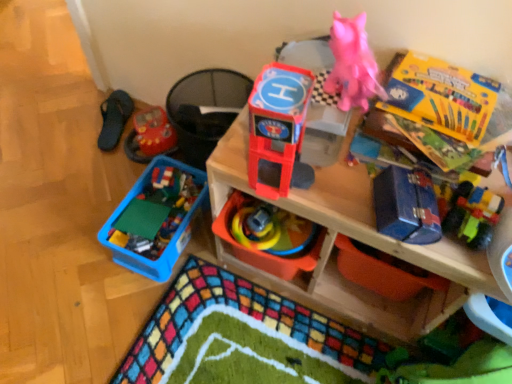
Measure the distance between point (389, 184) and camera.

Point (389, 184) and camera are 33.31 inches apart.

Describe the element at coordinates (114, 119) in the screenshot. I see `black fabric slipper at left` at that location.

What do you see at coordinates (150, 136) in the screenshot?
I see `rubberized red toy car at left, acting as the fifth toy starting from the front` at bounding box center [150, 136].

I want to click on rubberized red toy car at left, acting as the fifth toy starting from the front, so click(150, 136).

What do you see at coordinates (172, 237) in the screenshot?
I see `blue plastic container at lower left, the 4th toy viewed from the front` at bounding box center [172, 237].

Where is `blue metallic toolbox at upper right, placed as the first storage box when sorted from bottom to top`? blue metallic toolbox at upper right, placed as the first storage box when sorted from bottom to top is located at coordinates (380, 294).

Considering the relative sizes of yellow cardboard box at upper right, which appears as the third storage box when ordered from the bottom, and rubberized plastic toy at center, which is the 3th toy in back-to-front order, in the image provided, is yellow cardboard box at upper right, which appears as the third storage box when ordered from the bottom, wider than rubberized plastic toy at center, which is the 3th toy in back-to-front order,?

Yes.

From a real-world perspective, is yellow cardboard box at upper right, which appears as the third storage box when ordered from the bottom, on top of rubberized plastic toy at center, placed as the 3th toy when sorted from front to back?

Yes, from a real-world perspective, yellow cardboard box at upper right, which appears as the third storage box when ordered from the bottom, is above rubberized plastic toy at center, placed as the 3th toy when sorted from front to back.

Is yellow cardboard box at upper right, arranged as the first storage box when viewed from the top, oriented towards rubberized plastic toy at center, placed as the 3th toy when sorted from front to back?

No, yellow cardboard box at upper right, arranged as the first storage box when viewed from the top, is not facing towards rubberized plastic toy at center, placed as the 3th toy when sorted from front to back.

Does yellow cardboard box at upper right, which appears as the third storage box when ordered from the bottom, have a lesser height compared to rubberized plastic toy at center, which is the 3th toy in back-to-front order?

Yes.

From a real-world perspective, who is located lower, rubberized red toy car at left, the 1th toy positioned from the back, or matte plastic shelf at upper center?

rubberized red toy car at left, the 1th toy positioned from the back.

Considering the relative positions of rubberized red toy car at left, the 1th toy positioned from the back, and matte plastic shelf at upper center in the image provided, is rubberized red toy car at left, the 1th toy positioned from the back, to the left or to the right of matte plastic shelf at upper center?

In the image, rubberized red toy car at left, the 1th toy positioned from the back, appears on the left side of matte plastic shelf at upper center.

Between rubberized red toy car at left, the 1th toy positioned from the back, and matte plastic shelf at upper center, which one has less height?

rubberized red toy car at left, the 1th toy positioned from the back, is shorter.

Is matte plastic toy at upper center, which is the second storage box in bottom-to-top order, aimed at blue plastic container at lower left, the 4th toy viewed from the front?

No.

Is point (342, 122) behind point (150, 278)?

No.

From a real-world perspective, is matte plastic toy at upper center, which is the second storage box in bottom-to-top order, over blue plastic container at lower left, the second toy positioned from the back?

Yes, from a real-world perspective, matte plastic toy at upper center, which is the second storage box in bottom-to-top order, is over blue plastic container at lower left, the second toy positioned from the back

Can you confirm if matte plastic toy at upper center, which is the second storage box in bottom-to-top order, is shorter than blue plastic container at lower left, the 4th toy viewed from the front?

Yes.

From the image's perspective, which one is positioned lower, shiny plastic toy helicopter at center, which ranks as the first toy in front-to-back order, or rubberized plastic toy at center, placed as the 3th toy when sorted from front to back?

rubberized plastic toy at center, placed as the 3th toy when sorted from front to back, appears lower in the image.

Between shiny plastic toy helicopter at center, which ranks as the first toy in front-to-back order, and rubberized plastic toy at center, placed as the 3th toy when sorted from front to back, which one has smaller width?

With smaller width is shiny plastic toy helicopter at center, which ranks as the first toy in front-to-back order.

Is shiny plastic toy helicopter at center, which ranks as the first toy in front-to-back order, not close to rubberized plastic toy at center, placed as the 3th toy when sorted from front to back?

No.

How distant is shiny plastic toy helicopter at center, the 5th toy in the back-to-front sequence, from rubberized plastic toy at center, placed as the 3th toy when sorted from front to back?

A distance of 11.49 inches exists between shiny plastic toy helicopter at center, the 5th toy in the back-to-front sequence, and rubberized plastic toy at center, placed as the 3th toy when sorted from front to back.

Is matte plastic shelf at upper center looking in the opposite direction of matte plastic toy at upper center, which appears as the second storage box when viewed from the top?

matte plastic shelf at upper center is not turned away from matte plastic toy at upper center, which appears as the second storage box when viewed from the top.

Considering the sizes of matte plastic shelf at upper center and matte plastic toy at upper center, which appears as the second storage box when viewed from the top, in the image, is matte plastic shelf at upper center taller or shorter than matte plastic toy at upper center, which appears as the second storage box when viewed from the top,?

In the image, matte plastic shelf at upper center appears to be taller than matte plastic toy at upper center, which appears as the second storage box when viewed from the top.

Between matte plastic shelf at upper center and matte plastic toy at upper center, which appears as the second storage box when viewed from the top, which one has smaller width?

matte plastic toy at upper center, which appears as the second storage box when viewed from the top.

Is matte plastic shelf at upper center completely or partially outside of matte plastic toy at upper center, which is the second storage box in bottom-to-top order?

Yes, matte plastic shelf at upper center is not within matte plastic toy at upper center, which is the second storage box in bottom-to-top order.

Does black fabric slipper at left have a larger size compared to blue metallic toolbox at right, marked as the second toy in a front-to-back arrangement?

Yes.

Which is closer to the camera, [110,101] or [402,206]?

Point [110,101] appears to be farther away from the viewer than point [402,206].

Which object is further away from the camera taking this photo, black fabric slipper at left or blue metallic toolbox at right, placed as the 4th toy when sorted from back to front?

black fabric slipper at left is more distant.

How much distance is there between black fabric slipper at left and blue metallic toolbox at right, marked as the second toy in a front-to-back arrangement?

black fabric slipper at left is 3.84 feet away from blue metallic toolbox at right, marked as the second toy in a front-to-back arrangement.

Considering their positions, is matte plastic shelf at upper center located in front of or behind rubberized plastic toy at center, placed as the 3th toy when sorted from front to back?

Visually, matte plastic shelf at upper center is located in front of rubberized plastic toy at center, placed as the 3th toy when sorted from front to back.

Is matte plastic shelf at upper center aimed at rubberized plastic toy at center, placed as the 3th toy when sorted from front to back?

Yes, matte plastic shelf at upper center is turned towards rubberized plastic toy at center, placed as the 3th toy when sorted from front to back.

Between matte plastic shelf at upper center and rubberized plastic toy at center, placed as the 3th toy when sorted from front to back, which one has smaller size?

rubberized plastic toy at center, placed as the 3th toy when sorted from front to back.

From the image's perspective, which one is positioned lower, matte plastic shelf at upper center or rubberized plastic toy at center, placed as the 3th toy when sorted from front to back?

From the image's view, rubberized plastic toy at center, placed as the 3th toy when sorted from front to back, is below.

From the image's perspective, count 4th toys downward from the yellow cardboard box at upper right, arranged as the first storage box when viewed from the top, and point to it. Please provide its 2D coordinates.

[(269, 237)]

The width and height of the screenshot is (512, 384). I want to click on the 2nd toy located beneath the matte plastic shelf at upper center (from a real-world perspective), so click(x=150, y=136).

When comparing their distances from blue metallic toolbox at upper right, positioned as the 3th storage box in top-to-bottom order, does matte plastic toy at upper center, which appears as the second storage box when viewed from the top, or black fabric slipper at left seem closer?

matte plastic toy at upper center, which appears as the second storage box when viewed from the top, lies closer to blue metallic toolbox at upper right, positioned as the 3th storage box in top-to-bottom order, than the other object.

Estimate the real-world distances between objects in this image. Which object is further from matte plastic toy at upper center, which appears as the second storage box when viewed from the top, rubberized red toy car at left, the 1th toy positioned from the back, or black fabric slipper at left?

black fabric slipper at left.

Considering their positions, is blue metallic toolbox at right, marked as the second toy in a front-to-back arrangement, positioned further to matte plastic toy at upper center, which appears as the second storage box when viewed from the top, than black fabric slipper at left?

black fabric slipper at left is further to matte plastic toy at upper center, which appears as the second storage box when viewed from the top.

Which object lies nearer to the anchor point blue metallic toolbox at upper right, placed as the first storage box when sorted from bottom to top, matte plastic toy at upper center, which appears as the second storage box when viewed from the top, or yellow cardboard box at upper right, arranged as the first storage box when viewed from the top?

matte plastic toy at upper center, which appears as the second storage box when viewed from the top, is positioned closer to the anchor blue metallic toolbox at upper right, placed as the first storage box when sorted from bottom to top.

Estimate the real-world distances between objects in this image. Which object is closer to matte plastic shelf at upper center, blue metallic toolbox at upper right, placed as the first storage box when sorted from bottom to top, or yellow cardboard box at upper right, arranged as the first storage box when viewed from the top?

Among the two, blue metallic toolbox at upper right, placed as the first storage box when sorted from bottom to top, is located nearer to matte plastic shelf at upper center.

Considering their positions, is matte plastic shelf at upper center positioned closer to rubberized plastic toy at center, placed as the 3th toy when sorted from front to back, than black fabric slipper at left?

The object closer to rubberized plastic toy at center, placed as the 3th toy when sorted from front to back, is matte plastic shelf at upper center.

Estimate the real-world distances between objects in this image. Which object is closer to shiny plastic toy helicopter at center, the 5th toy in the back-to-front sequence, rubberized red toy car at left, acting as the fifth toy starting from the front, or matte plastic shelf at upper center?

matte plastic shelf at upper center lies closer to shiny plastic toy helicopter at center, the 5th toy in the back-to-front sequence, than the other object.

Estimate the real-world distances between objects in this image. Which object is closer to blue metallic toolbox at right, placed as the 4th toy when sorted from back to front, black fabric slipper at left or matte plastic toy at upper center, which is the second storage box in bottom-to-top order?

The object closer to blue metallic toolbox at right, placed as the 4th toy when sorted from back to front, is matte plastic toy at upper center, which is the second storage box in bottom-to-top order.

At what (x,y) coordinates should I click in order to perform the action: click on shelf between shiny plastic toy helicopter at center, the 5th toy in the back-to-front sequence, and rubberized plastic toy at center, placed as the 3th toy when sorted from front to back, along the z-axis. Please return your answer as a coordinate pair (x, y). Looking at the image, I should click on (374, 247).

Image resolution: width=512 pixels, height=384 pixels. I want to click on toy between shiny plastic toy helicopter at center, the 5th toy in the back-to-front sequence, and matte plastic shelf at upper center, in the horizontal direction, so click(406, 206).

Where is `toy between shiny plastic toy helicopter at center, which ranks as the first toy in front-to-back order, and rubberized plastic toy at center, placed as the 3th toy when sorted from front to back, from front to back`? The width and height of the screenshot is (512, 384). toy between shiny plastic toy helicopter at center, which ranks as the first toy in front-to-back order, and rubberized plastic toy at center, placed as the 3th toy when sorted from front to back, from front to back is located at coordinates 406,206.

Identify the location of toy between matte plastic toy at upper center, which is the second storage box in bottom-to-top order, and yellow cardboard box at upper right, arranged as the first storage box when viewed from the top. The image size is (512, 384). (406, 206).